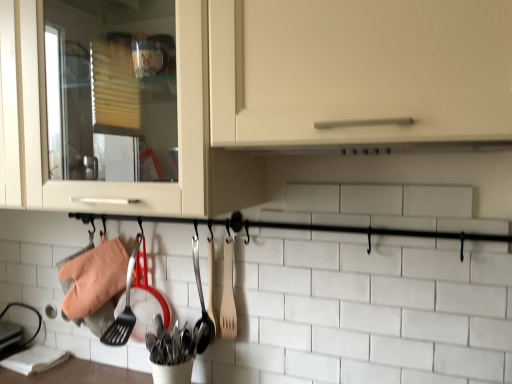
Question: Is wooden spoon at center, arranged as the 2th silverware when viewed from the left, taller or shorter than wooden spatula at center?

Choices:
 (A) short
 (B) tall

Answer: (B)

Question: Looking at the image, does wooden spoon at center, arranged as the 2th silverware when viewed from the left, seem bigger or smaller compared to wooden spatula at center?

Choices:
 (A) big
 (B) small

Answer: (B)

Question: Which object is the farthest from the wooden spoon at center, which ranks as the first silverware in right-to-left order?

Choices:
 (A) matte white cabinet at center
 (B) polished stainless steel utensils at center, which ranks as the 2th silverware in right-to-left order
 (C) wooden spatula at center

Answer: (A)

Question: Which is farther from the matte white cabinet at center?

Choices:
 (A) wooden spatula at center
 (B) polished stainless steel utensils at center, arranged as the first silverware when viewed from the left
 (C) wooden spoon at center, arranged as the 2th silverware when viewed from the left

Answer: (B)